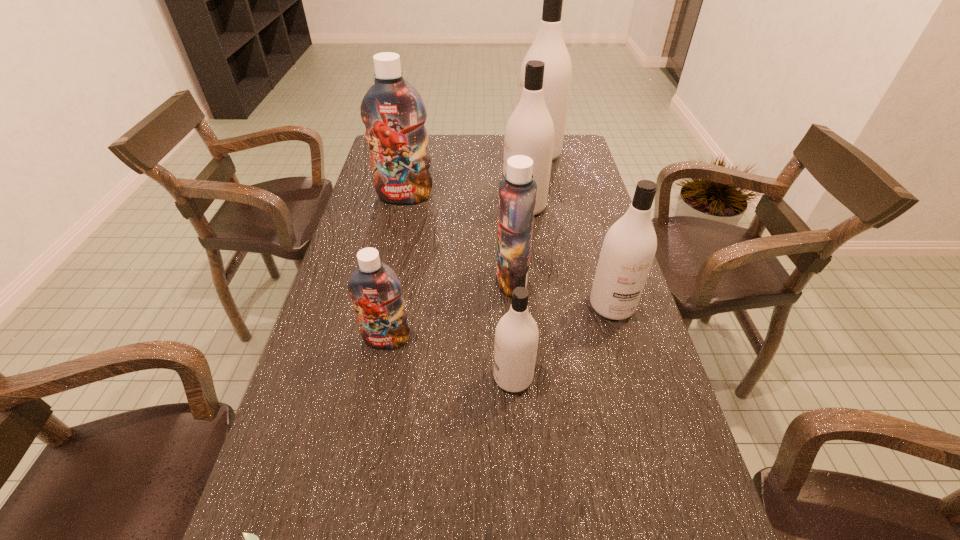
Identify the location of blue shampoo that is the second closest to the second farthest blue shampoo. (392, 110).

Identify which blue shampoo is the second nearest to the farthest blue shampoo. Please provide its 2D coordinates. Your answer should be formatted as a tuple, i.e. [(x, y)], where the tuple contains the x and y coordinates of a point satisfying the conditions above.

[(374, 287)]

Identify the location of free spot that satisfies the following two spatial constraints: 1. on the front-facing side of the tallest shampoo; 2. on the front label of the third nearest object. (574, 340).

Where is `free space that satisfies the following two spatial constraints: 1. on the front-facing side of the farthest shampoo; 2. on the front label of the smallest blue shampoo`? Image resolution: width=960 pixels, height=540 pixels. free space that satisfies the following two spatial constraints: 1. on the front-facing side of the farthest shampoo; 2. on the front label of the smallest blue shampoo is located at coordinates (574, 340).